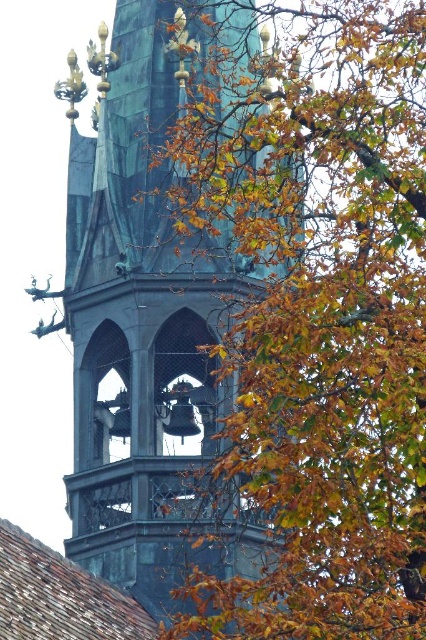
Is autumn leaves at upper right shorter than green patina tower at center?

Incorrect, autumn leaves at upper right's height does not fall short of green patina tower at center's.

Based on the photo, who is lower down, autumn leaves at upper right or green patina tower at center?

green patina tower at center is lower down.

Find the location of a particular element. autumn leaves at upper right is located at coordinates (314, 314).